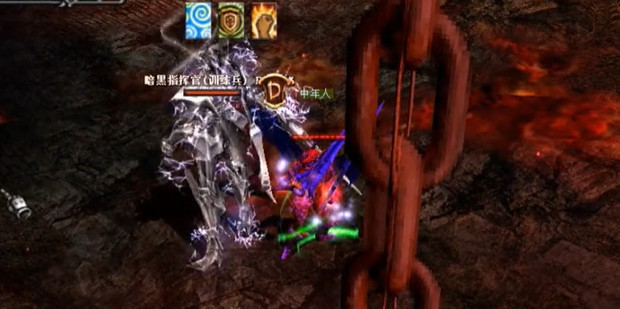
You are a GUI agent. You are given a task and a screenshot of the screen. Output one action in this format:
    pyautogui.click(x=<x>, y=<y>)
    Task: Click on the bright white lights
    
    Given the screenshot: What is the action you would take?
    pyautogui.click(x=330, y=218), pyautogui.click(x=341, y=213), pyautogui.click(x=347, y=213), pyautogui.click(x=315, y=219), pyautogui.click(x=281, y=159), pyautogui.click(x=281, y=179)